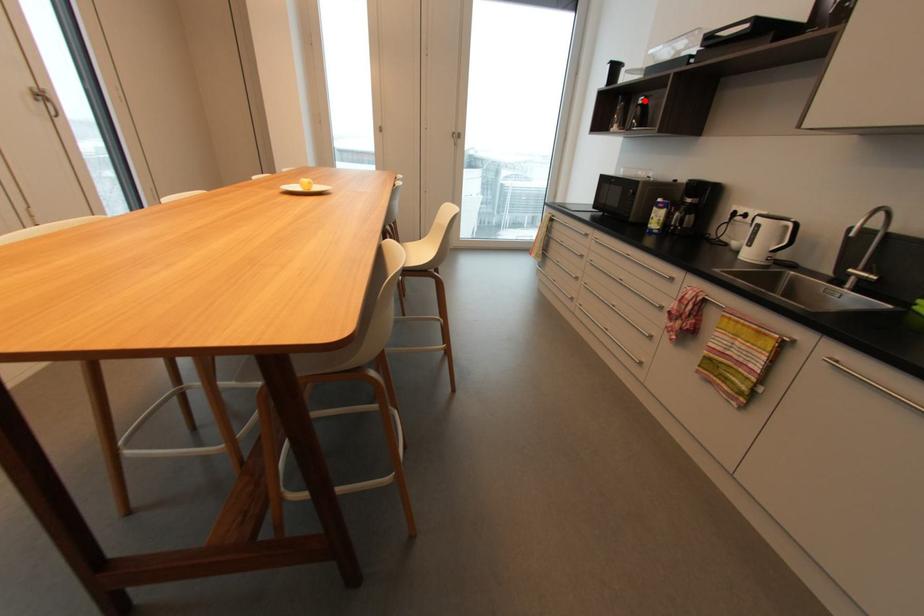
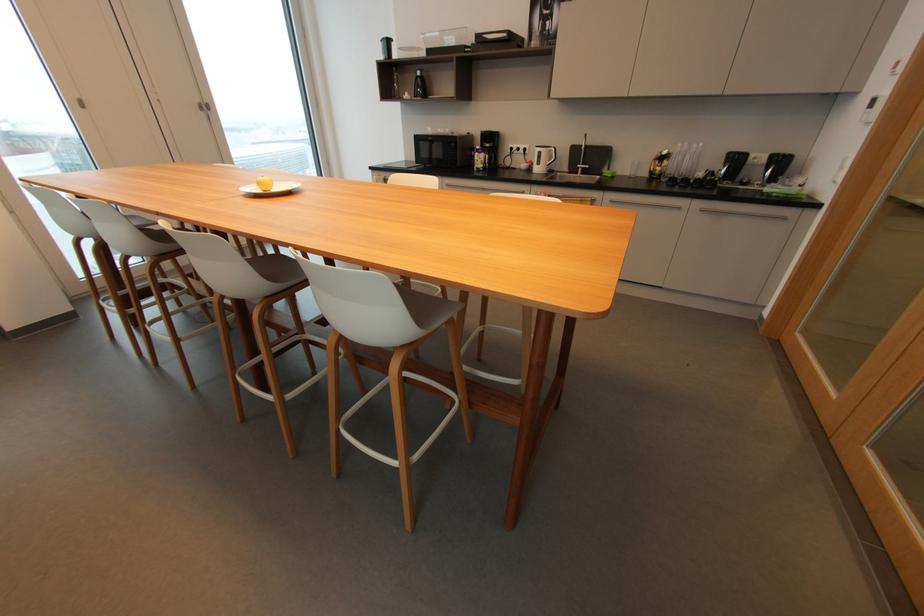
Question: I am providing you with two images of the same scene from different viewpoints. Given a red point in image1, look at the same physical point in image2. Is it:

Choices:
 (A) Closer to the viewpoint
 (B) Farther from the viewpoint

Answer: (A)